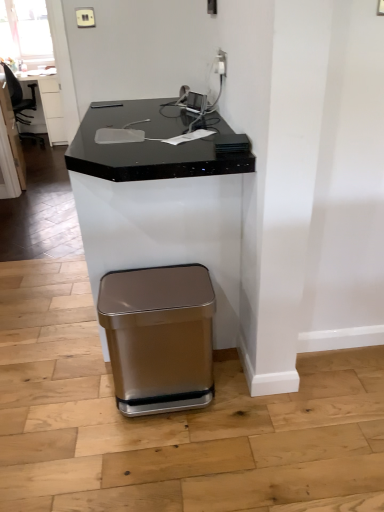
Question: Is satin gold outlet at upper center further to camera compared to satin gold trash can at lower center?

Choices:
 (A) yes
 (B) no

Answer: (A)

Question: Is satin gold outlet at upper center smaller than satin gold trash can at lower center?

Choices:
 (A) yes
 (B) no

Answer: (A)

Question: Is satin gold trash can at lower center surrounded by satin gold outlet at upper center?

Choices:
 (A) yes
 (B) no

Answer: (B)

Question: Considering the relative sizes of satin gold outlet at upper center and satin gold trash can at lower center in the image provided, is satin gold outlet at upper center taller than satin gold trash can at lower center?

Choices:
 (A) yes
 (B) no

Answer: (B)

Question: Is satin gold outlet at upper center facing away from satin gold trash can at lower center?

Choices:
 (A) yes
 (B) no

Answer: (B)

Question: From the image's perspective, is black granite table at upper left located above or below black granite desk at center?

Choices:
 (A) above
 (B) below

Answer: (A)

Question: Considering the positions of black granite table at upper left and black granite desk at center in the image, is black granite table at upper left wider or thinner than black granite desk at center?

Choices:
 (A) thin
 (B) wide

Answer: (B)

Question: In terms of size, does black granite table at upper left appear bigger or smaller than black granite desk at center?

Choices:
 (A) big
 (B) small

Answer: (B)

Question: Do you think black granite table at upper left is within black granite desk at center, or outside of it?

Choices:
 (A) inside
 (B) outside

Answer: (B)

Question: From a real-world perspective, is black leather swivel chair at left above or below satin gold outlet at upper center?

Choices:
 (A) above
 (B) below

Answer: (B)

Question: Does point (21, 117) appear closer or farther from the camera than point (221, 72)?

Choices:
 (A) farther
 (B) closer

Answer: (A)

Question: In the image, is black leather swivel chair at left positioned in front of or behind satin gold outlet at upper center?

Choices:
 (A) behind
 (B) front

Answer: (A)

Question: Considering the relative positions of black leather swivel chair at left and satin gold outlet at upper center in the image provided, is black leather swivel chair at left to the left or to the right of satin gold outlet at upper center?

Choices:
 (A) left
 (B) right

Answer: (A)

Question: Is black granite desk at center inside or outside of black granite table at upper left?

Choices:
 (A) inside
 (B) outside

Answer: (B)

Question: From the image's perspective, relative to black granite table at upper left, is black granite desk at center above or below?

Choices:
 (A) below
 (B) above

Answer: (A)